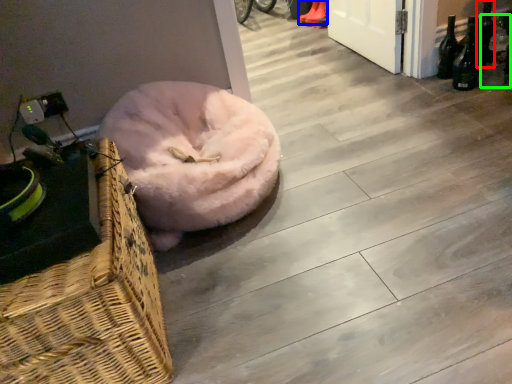
Question: Which object is the closest to the bottle (highlighted by a red box)? Choose among these: footwear (highlighted by a blue box) or bottle (highlighted by a green box).

Choices:
 (A) footwear
 (B) bottle

Answer: (B)